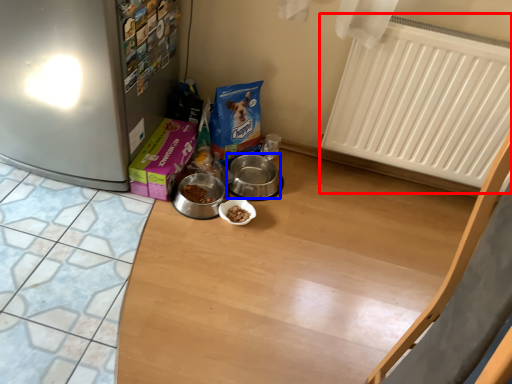
Question: Which point is further to the camera, radiator (highlighted by a red box) or appliance (highlighted by a blue box)?

Choices:
 (A) radiator
 (B) appliance

Answer: (B)